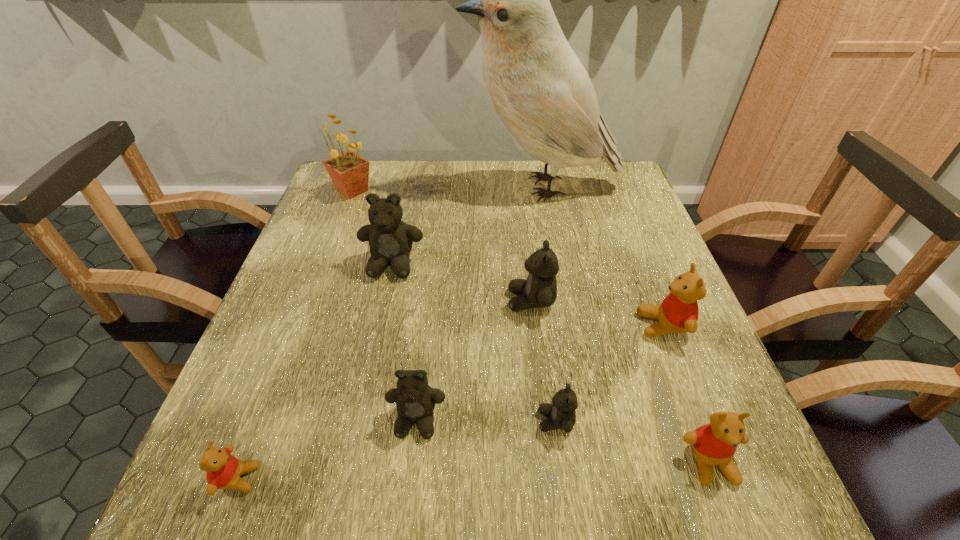
Identify the location of the leftmost teddy bear. (224, 470).

Locate an element on the screen. This screenshot has height=540, width=960. the smallest red teddy bear is located at coordinates (224, 470).

This screenshot has width=960, height=540. Identify the location of vacant region located 0.080m on the face of the tallest object. (433, 187).

Image resolution: width=960 pixels, height=540 pixels. I want to click on free location located 0.250m on the face of the tallest object, so click(x=374, y=187).

The height and width of the screenshot is (540, 960). What are the coordinates of `free region located 0.140m on the face of the tallest object` in the screenshot? It's located at (412, 187).

Locate an element on the screen. The width and height of the screenshot is (960, 540). free location located 0.230m at the front of the sunflower with flowers visible is located at coordinates (327, 260).

Identify the location of free spot located 0.120m on the face of the seventh shortest object. This screenshot has height=540, width=960. (379, 323).

The width and height of the screenshot is (960, 540). I want to click on vacant position located 0.290m on the face of the second biggest brown teddy bear, so click(x=372, y=301).

Locate an element on the screen. The width and height of the screenshot is (960, 540). vacant space located 0.180m on the face of the second biggest brown teddy bear is located at coordinates (424, 301).

Image resolution: width=960 pixels, height=540 pixels. I want to click on free region located 0.170m on the face of the second biggest brown teddy bear, so click(x=428, y=301).